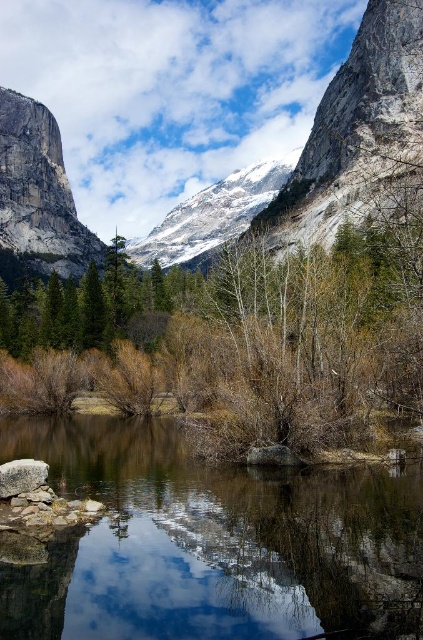
Identify the location of clear water at center. This screenshot has height=640, width=423. (211, 541).

Can you confirm if clear water at center is thinner than gray rough stone at lower left?

No.

Does point (178, 538) lie behind point (33, 486)?

No, it is not.

Identify the location of clear water at center. The height and width of the screenshot is (640, 423). (211, 541).

Is clear water at center wider than gray stone mountain at center?

No.

In the scene shown: Which of these two, clear water at center or gray stone mountain at center, stands shorter?

clear water at center is shorter.

Image resolution: width=423 pixels, height=640 pixels. Describe the element at coordinates (211, 541) in the screenshot. I see `clear water at center` at that location.

At what (x,y) coordinates should I click in order to perform the action: click on clear water at center. Please return your answer as a coordinate pair (x, y). This screenshot has height=640, width=423. Looking at the image, I should click on (211, 541).

From the picture: Which is more to the right, clear water at center or green matte tree at center?

Positioned to the right is clear water at center.

The width and height of the screenshot is (423, 640). Describe the element at coordinates (211, 541) in the screenshot. I see `clear water at center` at that location.

The width and height of the screenshot is (423, 640). I want to click on clear water at center, so click(x=211, y=541).